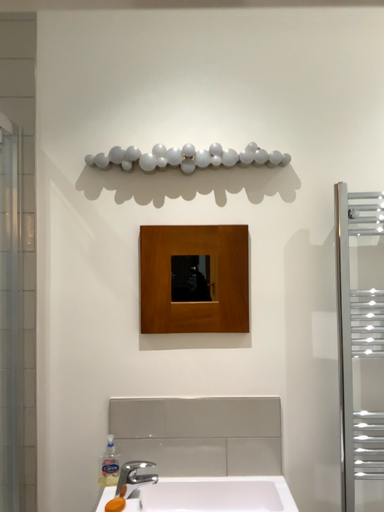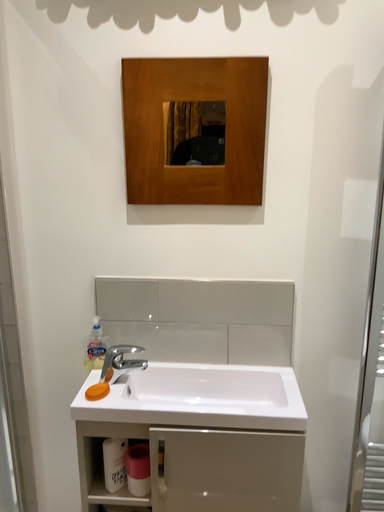
Question: Which way did the camera rotate in the video?

Choices:
 (A) rotated downward
 (B) rotated upward

Answer: (A)